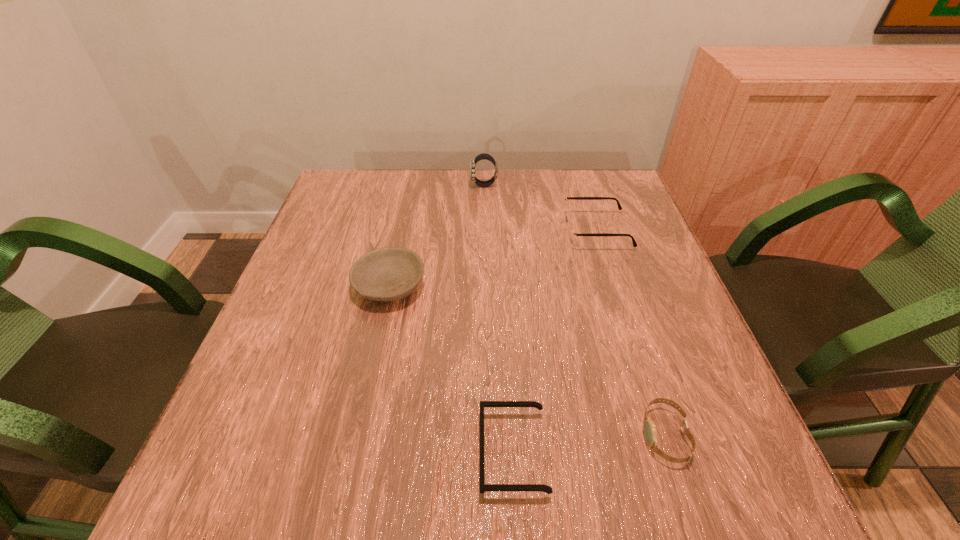
Find the location of a particular element. The width and height of the screenshot is (960, 540). the taller watch is located at coordinates (485, 156).

You are a GUI agent. You are given a task and a screenshot of the screen. Output one action in this format:
    pyautogui.click(x=<x>, y=<y>)
    Task: Click on the left watch
    The height and width of the screenshot is (540, 960).
    Given the screenshot: What is the action you would take?
    pyautogui.click(x=485, y=156)

Find the location of `the fourth nearest object`. the fourth nearest object is located at coordinates (572, 234).

This screenshot has height=540, width=960. I want to click on bowl, so click(386, 274).

Where is `the third nearest object`? The height and width of the screenshot is (540, 960). the third nearest object is located at coordinates (386, 274).

At what (x,y) coordinates should I click in order to perform the action: click on the nearer watch. Please return your answer as a coordinate pair (x, y). The width and height of the screenshot is (960, 540). Looking at the image, I should click on (649, 428).

Where is `the right watch`? The image size is (960, 540). the right watch is located at coordinates (649, 428).

Locate an element on the screen. This screenshot has height=540, width=960. sunglasses is located at coordinates [x=484, y=487].

Identify the location of free space located 0.110m on the face of the farther watch. [x=432, y=185].

In order to click on free space located on the face of the farther watch in this screenshot , I will do `click(352, 185)`.